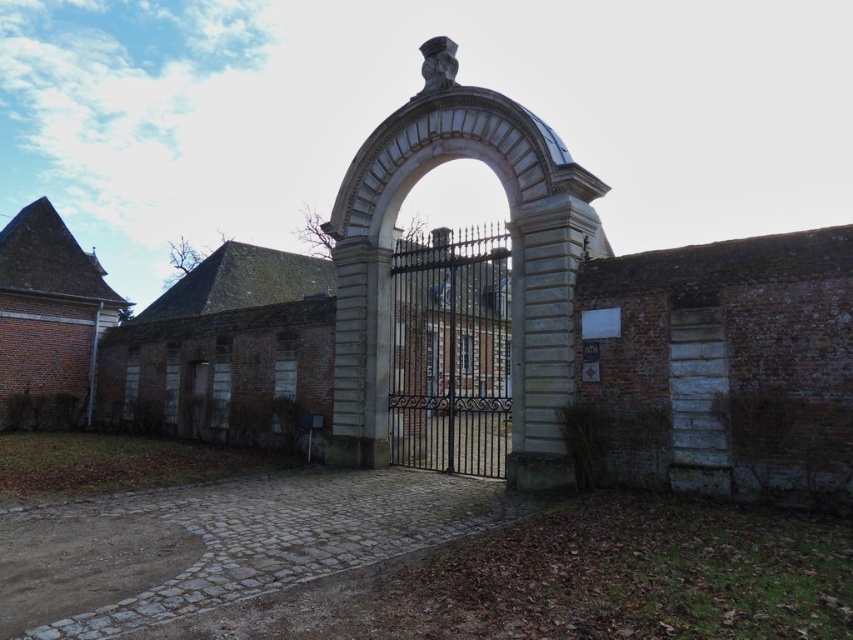
From the picture: Does black wrought iron gate at center appear on the left side of brown wooden door at center?

In fact, black wrought iron gate at center is to the right of brown wooden door at center.

Who is lower down, black wrought iron gate at center or brown wooden door at center?

brown wooden door at center is below.

Is point (427, 417) farther from camera compared to point (194, 380)?

No, (427, 417) is in front of (194, 380).

The width and height of the screenshot is (853, 640). Identify the location of black wrought iron gate at center. (451, 352).

Is white stone archway at center taller than brown wooden door at center?

Indeed, white stone archway at center has a greater height compared to brown wooden door at center.

Who is lower down, white stone archway at center or brown wooden door at center?

brown wooden door at center is lower down.

The height and width of the screenshot is (640, 853). Describe the element at coordinates (511, 260) in the screenshot. I see `white stone archway at center` at that location.

Identify the location of white stone archway at center. (511, 260).

Who is positioned more to the right, white stone archway at center or black wrought iron gate at center?

black wrought iron gate at center is more to the right.

Where is `white stone archway at center`? The height and width of the screenshot is (640, 853). white stone archway at center is located at coordinates (511, 260).